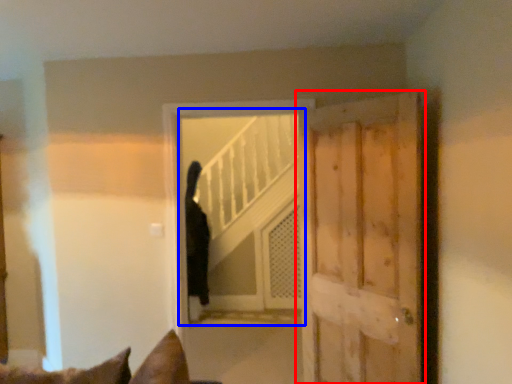
Question: Which of the following is the farthest to the observer, door (highlighted by a red box) or elevator (highlighted by a blue box)?

Choices:
 (A) door
 (B) elevator

Answer: (B)